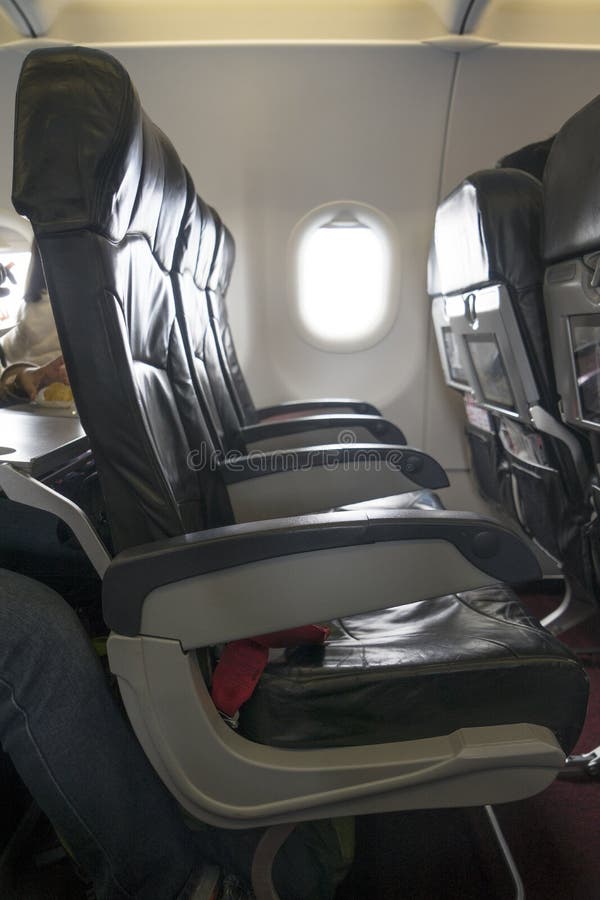
Locate an element on the screen. trays is located at coordinates (440, 351), (486, 320), (568, 307), (32, 438), (34, 410).